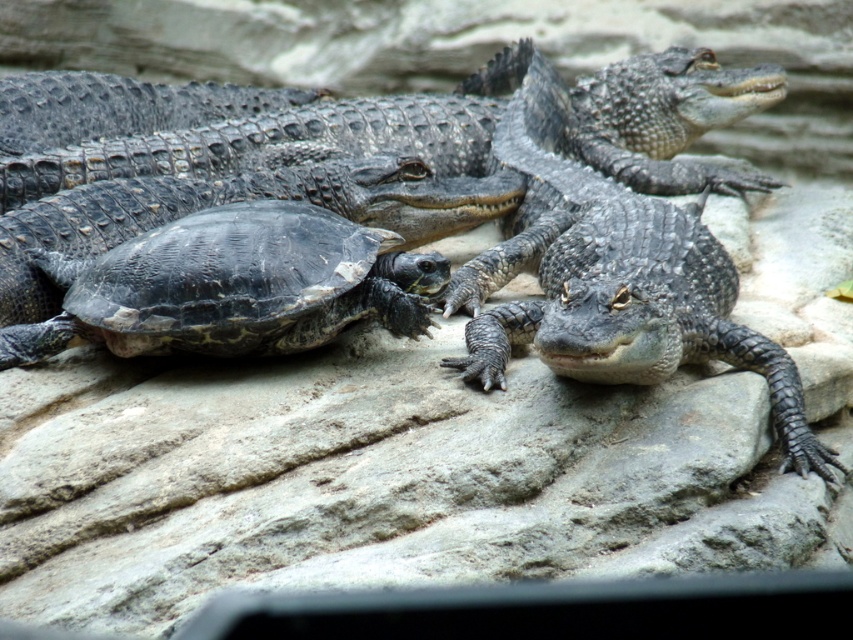
Question: In this image, where is shiny dark green crocodile at center located relative to shiny black alligator at center?

Choices:
 (A) left
 (B) right

Answer: (A)

Question: Which object is farther from the camera taking this photo?

Choices:
 (A) shiny black alligator at center
 (B) black textured shell at lower left
 (C) shiny dark green crocodile at center

Answer: (C)

Question: Which of the following is the farthest from the observer?

Choices:
 (A) (548, 100)
 (B) (637, 369)
 (C) (222, 294)

Answer: (A)

Question: Can you confirm if shiny dark green crocodile at center is bigger than black textured shell at lower left?

Choices:
 (A) yes
 (B) no

Answer: (A)

Question: Can you confirm if shiny dark green crocodile at center is thinner than shiny black alligator at center?

Choices:
 (A) no
 (B) yes

Answer: (A)

Question: Estimate the real-world distances between objects in this image. Which object is farther from the shiny black alligator at center?

Choices:
 (A) black textured shell at lower left
 (B) shiny dark green crocodile at center

Answer: (A)